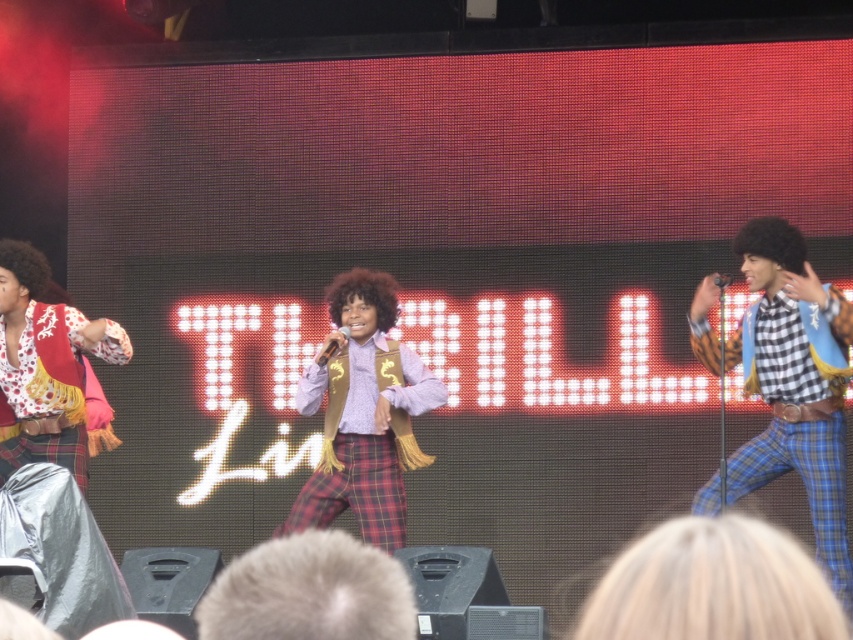
Question: Which object is farther from the camera taking this photo?

Choices:
 (A) fuzzy brown afro at center
 (B) plaid fabric pants at center

Answer: (B)

Question: Is checkered fabric pants at right positioned in front of fuzzy brown afro at center?

Choices:
 (A) yes
 (B) no

Answer: (B)

Question: Which point is closer to the camera taking this photo?

Choices:
 (A) (802, 241)
 (B) (625, 600)
 (C) (308, 412)

Answer: (B)

Question: Which point is farther from the camera taking this photo?

Choices:
 (A) (289, 611)
 (B) (780, 570)

Answer: (A)

Question: Does plaid fabric pants at center appear under fuzzy brown afro at center?

Choices:
 (A) no
 (B) yes

Answer: (A)

Question: Is fuzzy brown afro at center positioned before afro at right?

Choices:
 (A) yes
 (B) no

Answer: (A)